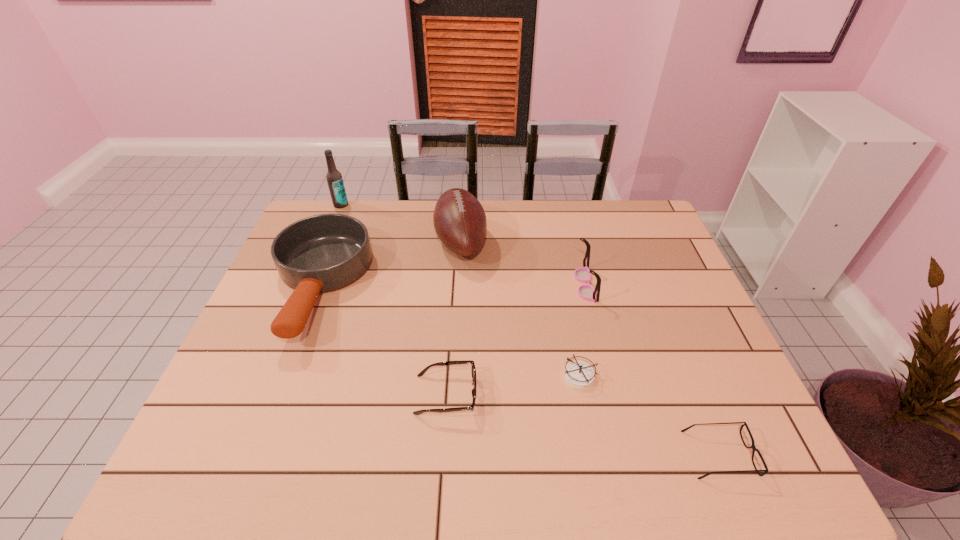
Locate an element on the screen. football (American) located at the far edge is located at coordinates (459, 219).

You are a GUI agent. You are given a task and a screenshot of the screen. Output one action in this format:
    pyautogui.click(x=<x>, y=<y>)
    Task: Click on the pan situated at the far edge
    
    Given the screenshot: What is the action you would take?
    pyautogui.click(x=322, y=253)

In order to click on object located at the near edge in this screenshot , I will do `click(752, 446)`.

Find the location of a particular element. beer bottle that is at the left edge is located at coordinates (334, 178).

The height and width of the screenshot is (540, 960). I want to click on pan situated at the left edge, so click(x=322, y=253).

Locate an element on the screen. object at the right edge is located at coordinates (752, 446).

Locate an element on the screen. The height and width of the screenshot is (540, 960). beer bottle that is at the far left corner is located at coordinates (334, 178).

The height and width of the screenshot is (540, 960). Identify the location of pan that is at the far left corner. (322, 253).

You are a GUI agent. You are given a task and a screenshot of the screen. Output one action in this format:
    pyautogui.click(x=<x>, y=<y>)
    Task: Click on the object at the near right corner
    The image size is (960, 540).
    Given the screenshot: What is the action you would take?
    pyautogui.click(x=752, y=446)

Locate an element on the screen. Image resolution: width=960 pixels, height=540 pixels. vacant space at the far edge of the desktop is located at coordinates (386, 230).